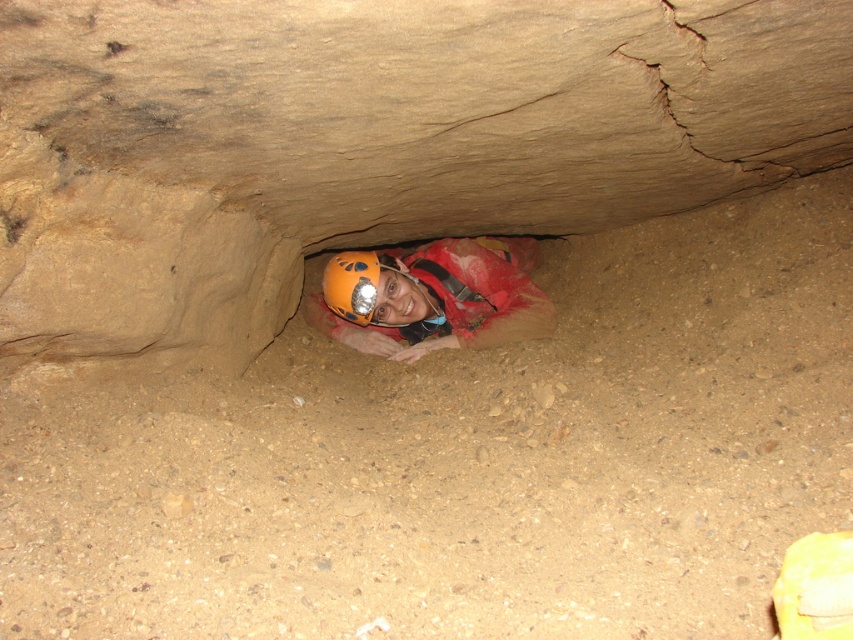
You are a caver wearing a headlamp and need to place your orange helmet at center and orange matte helmet at center on the ground. Which helmet should you place first to ensure both fit on the uneven ground without overlapping?

The orange matte helmet at center should be placed first since it is above the orange helmet at center, allowing both to fit without overlapping on the uneven ground.

Consider the image. You are a caver navigating through the cave passage shown in the image. You need to move from the point at coordinates point (x=447, y=268) to the point at coordinates point (x=352, y=289). Which direction should you move to get closer to your destination?

You should move downward because point (x=447, y=268) is further away from the camera compared to point (x=352, y=289). Since the destination is closer to the camera, moving downward in the image would bring you closer to it.

You are a caver wearing a headlamp and looking at two orange helmets in the cave. Which one is positioned to the right of the other? The orange helmet at center or the orange matte helmet at center?

The orange helmet at center is positioned to the right of the orange matte helmet at center.